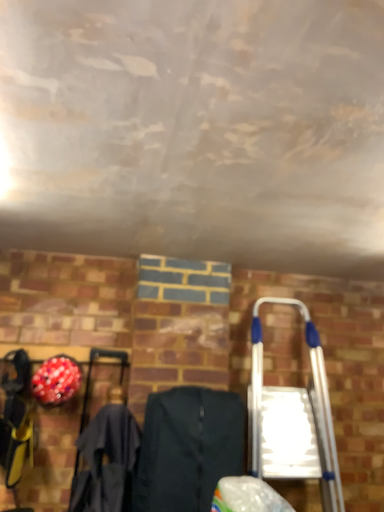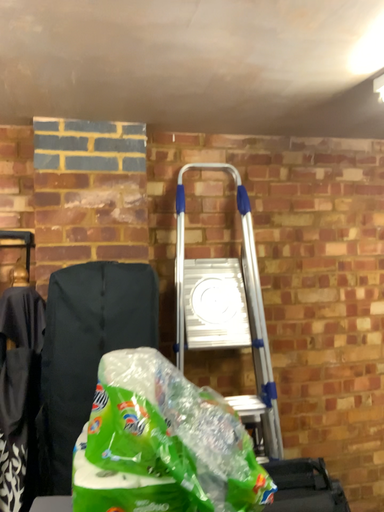
Question: Which way did the camera rotate in the video?

Choices:
 (A) rotated upward
 (B) rotated downward

Answer: (B)